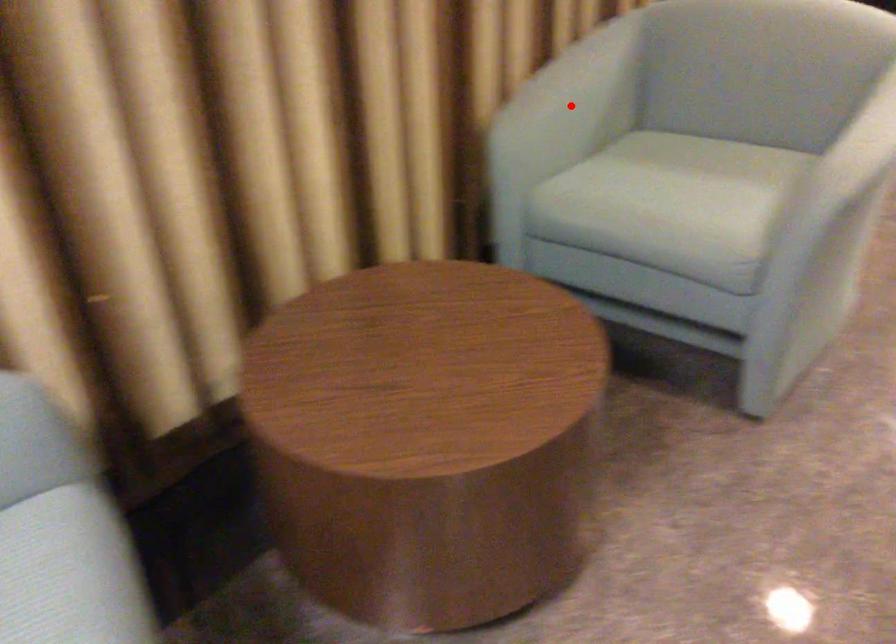
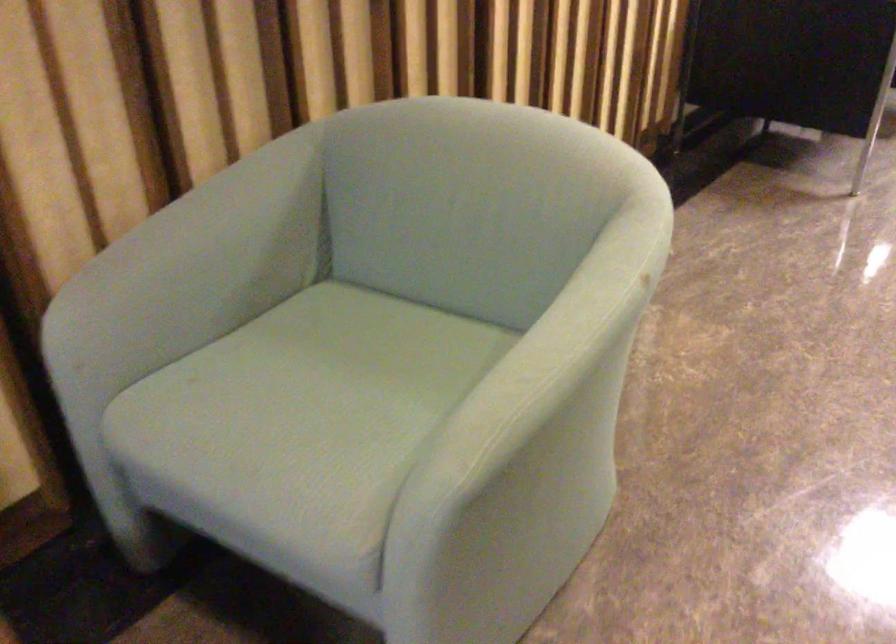
Question: A red point is marked in image1. In image2, is the corresponding 3D point closer to the camera or farther? Reply with the corresponding letter.

Choices:
 (A) The corresponding 3D point is closer.
 (B) The corresponding 3D point is farther.

Answer: (A)